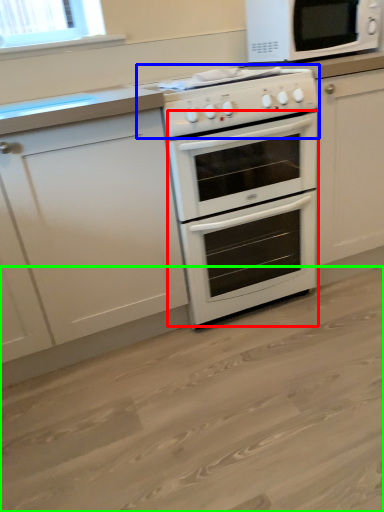
Question: Which is farther away from oven (highlighted by a red box)? gas stove (highlighted by a blue box) or plain (highlighted by a green box)?

Choices:
 (A) gas stove
 (B) plain

Answer: (B)